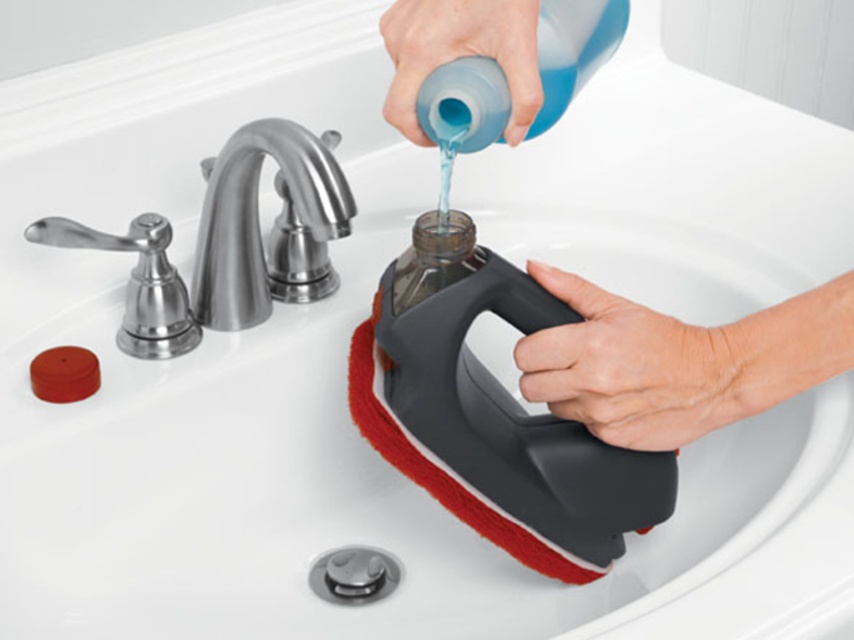
Which is above, brushed metal faucet at upper center or blue rubber glove at upper center?

blue rubber glove at upper center is higher up.

Does point (284, 262) lie behind point (471, 16)?

Yes, it is behind point (471, 16).

Where is `brushed metal faucet at upper center`? brushed metal faucet at upper center is located at coordinates (272, 227).

Between brushed metal faucet at upper center and red matte soap at lower left, which one has less height?

With less height is red matte soap at lower left.

Which is more to the right, brushed metal faucet at upper center or red matte soap at lower left?

Positioned to the right is brushed metal faucet at upper center.

Is point (287, 168) farther from camera compared to point (86, 369)?

No, it is in front of (86, 369).

The image size is (854, 640). What are the coordinates of `brushed metal faucet at upper center` in the screenshot? It's located at (272, 227).

Is gray rubber handle at lower right above red matte soap at lower left?

Yes, gray rubber handle at lower right is above red matte soap at lower left.

Between gray rubber handle at lower right and red matte soap at lower left, which one is positioned lower?

red matte soap at lower left is below.

Locate an element on the screen. The height and width of the screenshot is (640, 854). gray rubber handle at lower right is located at coordinates (629, 369).